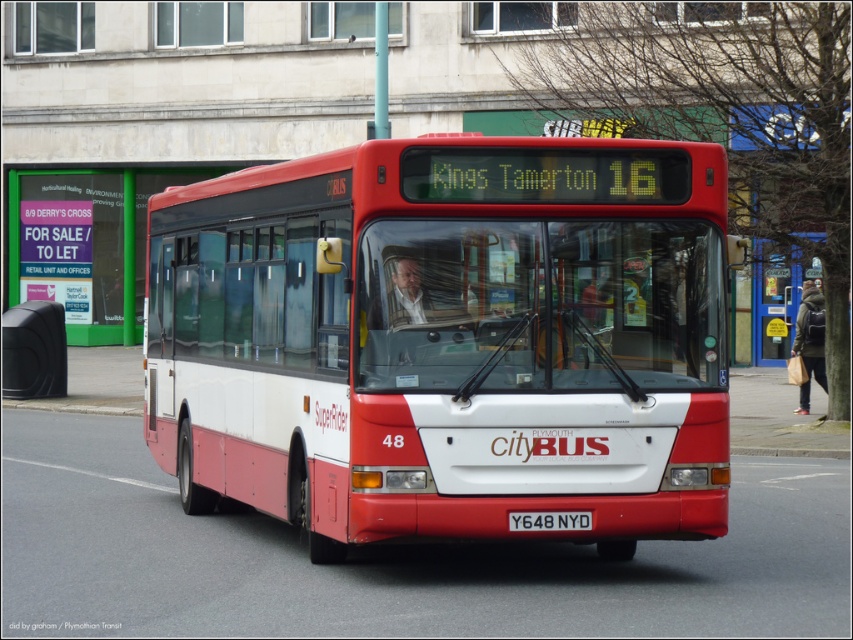
You are a delivery driver who needs to park your van behind the matte black speaker at left and the black metal license plate at center. Which object should you position your van closer to in order to ensure it is hidden from the front of the bus?

You should position your van closer to the matte black speaker at left because it is closer to you than the black metal license plate at center, so placing the van behind it would hide it better from the front view.

You are a pedestrian standing on the sidewalk. You see the red matte bus at center and the black metal license plate at center. Which object is closer to you?

The red matte bus at center is closer to you because it is in front of the black metal license plate at center.

You are standing on the sidewalk and looking at the bus. There are two points marked on the bus. One is at coordinate point (33, 380) and the other is at point (524, 525). Which point is closer to you?

Point (33, 380) is further to the camera than point (524, 525). Therefore, the point closer to you is point (524, 525).